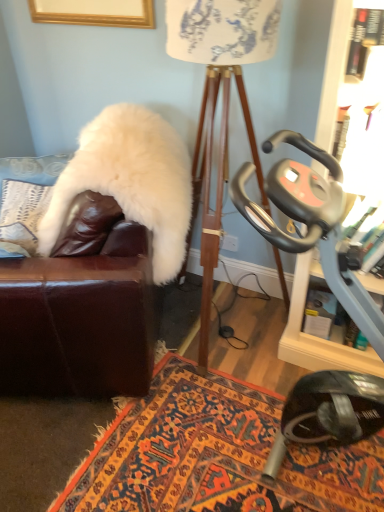
Identify the location of free space to the left of metallic gray stationary bike at right. (177, 436).